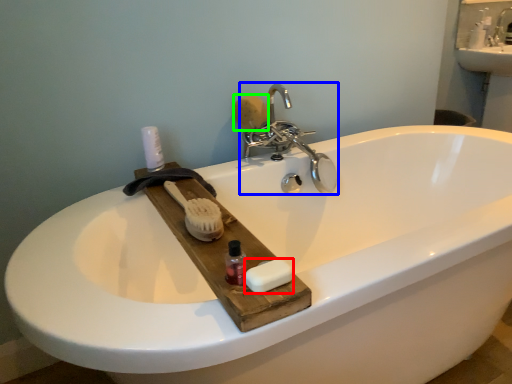
Question: Based on their relative distances, which object is farther from soap (highlighted by a red box)? Choose from tap (highlighted by a blue box) and soap (highlighted by a green box).

Choices:
 (A) tap
 (B) soap

Answer: (B)